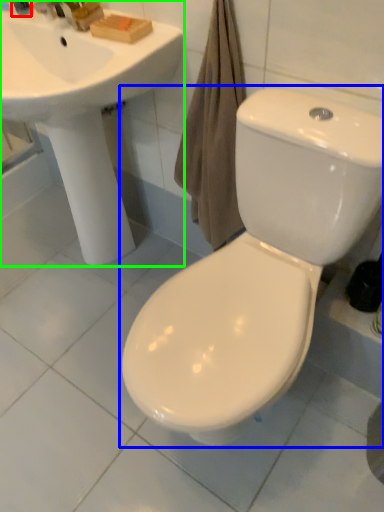
Question: Considering the real-world distances, which object is farthest from toiletry (highlighted by a red box)? toilet (highlighted by a blue box) or sink (highlighted by a green box)?

Choices:
 (A) toilet
 (B) sink

Answer: (A)